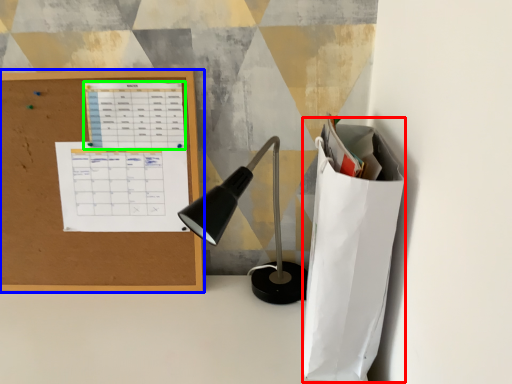
Question: Estimate the real-world distances between objects in this image. Which object is closer to paper bag (highlighted by a red box), office supplies (highlighted by a blue box) or notebook (highlighted by a green box)?

Choices:
 (A) office supplies
 (B) notebook

Answer: (B)